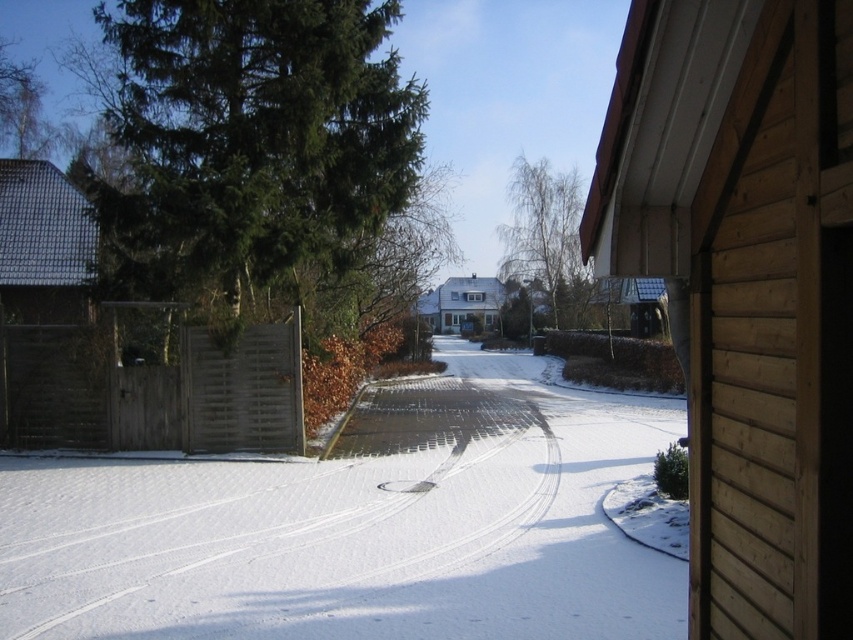
Measure the distance between point (x=485, y=424) and camera.

56.51 feet

Is point (207, 627) behind point (131, 65)?

No, it is in front of (131, 65).

This screenshot has height=640, width=853. What do you see at coordinates (358, 525) in the screenshot?
I see `white powdery snow at center` at bounding box center [358, 525].

At what (x,y) coordinates should I click in order to perform the action: click on white powdery snow at center. Please return your answer as a coordinate pair (x, y). This screenshot has width=853, height=640. Looking at the image, I should click on (358, 525).